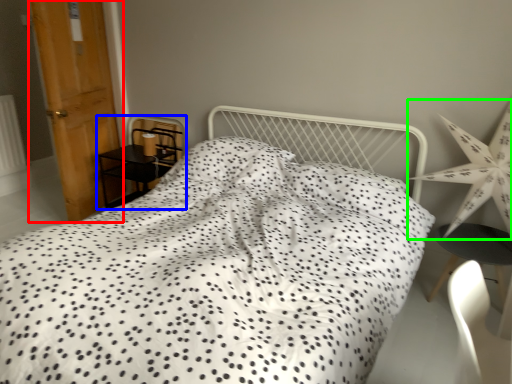
Question: Estimate the real-world distances between objects in this image. Which object is farther from door (highlighted by a red box), furniture (highlighted by a blue box) or star (highlighted by a green box)?

Choices:
 (A) furniture
 (B) star

Answer: (B)